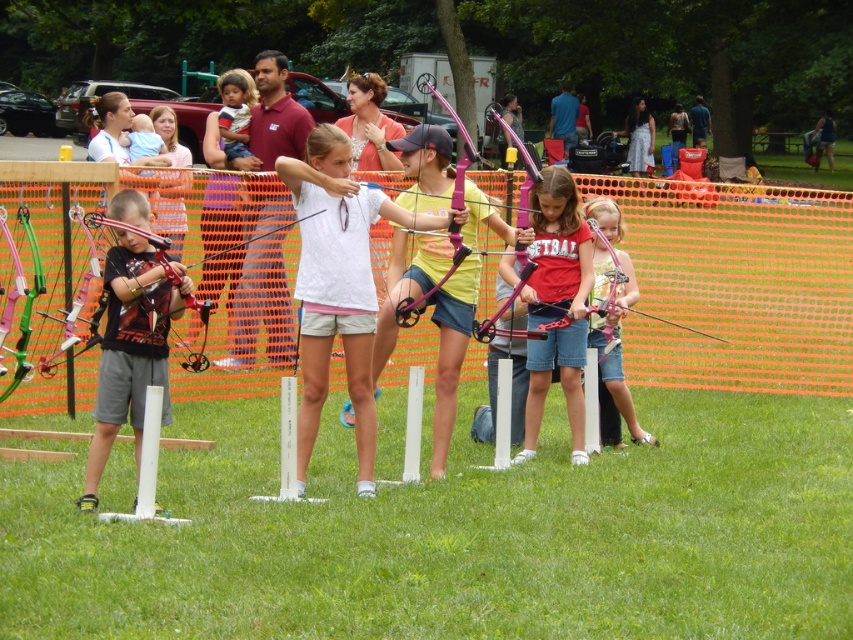
Question: Is matte black bow at left positioned in front of matte pink bow at center?

Choices:
 (A) yes
 (B) no

Answer: (A)

Question: Which is nearer to the white matte shirt at center?

Choices:
 (A) matte pink bow at upper right
 (B) matte pink bow at center
 (C) matte black bow at left
 (D) matte red bow at center

Answer: (C)

Question: Can you confirm if matte pink bow at center is wider than matte pink bow at upper right?

Choices:
 (A) no
 (B) yes

Answer: (A)

Question: Does white matte shirt at center lie behind matte red bow at center?

Choices:
 (A) yes
 (B) no

Answer: (B)

Question: Which point appears farthest from the camera in this image?

Choices:
 (A) (170, 413)
 (B) (561, 189)
 (C) (338, 314)
 (D) (619, 225)

Answer: (D)

Question: Which object is the farthest from the matte black bow at left?

Choices:
 (A) matte pink bow at center
 (B) matte pink bow at upper right

Answer: (B)